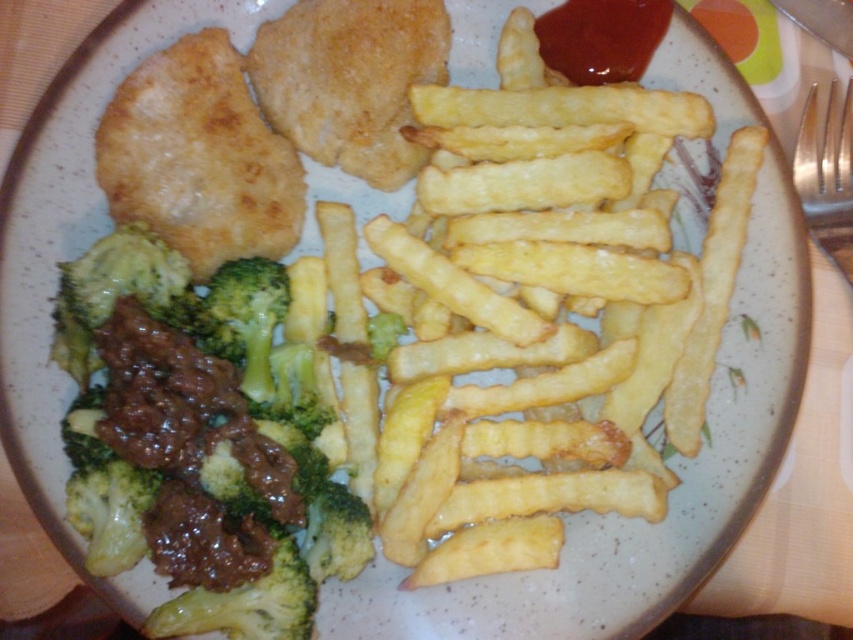
You are standing at a distance of 4 feet from the plate. Can you reach the point at coordinates point (219, 515) on the plate?

The point at coordinates point (219, 515) is 3.71 feet away from the camera, so yes, you can reach it since you are standing 4 feet away from the plate.

You are a food critic analyzing the arrangement of the broccoli on the plate. Which broccoli is positioned lower on the plate, the green matte broccoli at lower left or the green matte broccoli at center?

The green matte broccoli at lower left is positioned lower on the plate than the green matte broccoli at center.